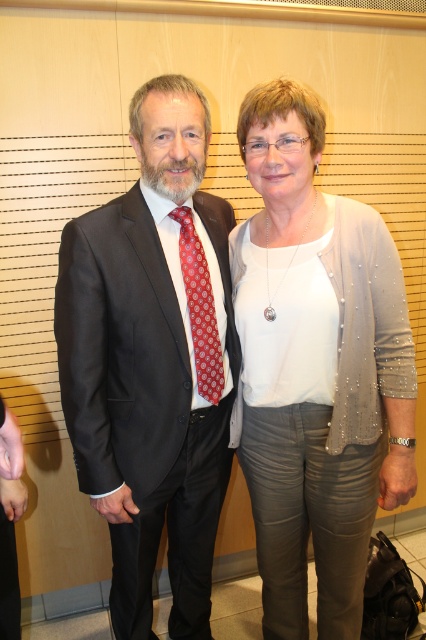
Question: In this image, where is pearl gray cardigan at center located relative to matte black suit at center?

Choices:
 (A) below
 (B) above

Answer: (B)

Question: Based on their relative distances, which object is nearer to the matte black suit at center?

Choices:
 (A) red dotted tie at center
 (B) pearl gray cardigan at center

Answer: (A)

Question: Is pearl gray cardigan at center positioned behind matte black suit at center?

Choices:
 (A) no
 (B) yes

Answer: (A)

Question: Which is farther from the matte black suit at center?

Choices:
 (A) red dotted tie at center
 (B) pearl gray cardigan at center

Answer: (B)

Question: Which object is farther from the camera taking this photo?

Choices:
 (A) red dotted tie at center
 (B) pearl gray cardigan at center

Answer: (A)

Question: Is pearl gray cardigan at center to the left of red dotted tie at center from the viewer's perspective?

Choices:
 (A) no
 (B) yes

Answer: (A)